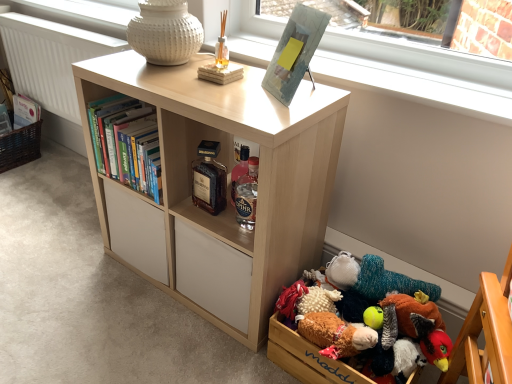
Question: Does fluffy multicolored stuffed toys at lower right, placed as the third toy when sorted from back to front, have a greater height compared to wooden plush toys at lower right?

Choices:
 (A) yes
 (B) no

Answer: (A)

Question: Is fluffy multicolored stuffed toys at lower right, the first toy viewed from the front, turned away from wooden plush toys at lower right?

Choices:
 (A) no
 (B) yes

Answer: (A)

Question: From a real-world perspective, is fluffy multicolored stuffed toys at lower right, placed as the third toy when sorted from back to front, on wooden plush toys at lower right?

Choices:
 (A) no
 (B) yes

Answer: (A)

Question: Does fluffy multicolored stuffed toys at lower right, placed as the third toy when sorted from back to front, have a larger size compared to wooden plush toys at lower right?

Choices:
 (A) yes
 (B) no

Answer: (A)

Question: From a real-world perspective, is fluffy multicolored stuffed toys at lower right, placed as the third toy when sorted from back to front, located beneath wooden plush toys at lower right?

Choices:
 (A) no
 (B) yes

Answer: (B)

Question: Does fluffy multicolored stuffed toys at lower right, the first toy viewed from the front, appear on the right side of wooden plush toys at lower right?

Choices:
 (A) yes
 (B) no

Answer: (A)

Question: From the image's perspective, is white textured radiator at lower left on knitted plush toy at lower right, the 1th toy viewed from the back?

Choices:
 (A) no
 (B) yes

Answer: (B)

Question: Is white textured radiator at lower left next to knitted plush toy at lower right, the 3th toy in the front-to-back sequence, and touching it?

Choices:
 (A) no
 (B) yes

Answer: (A)

Question: Is white textured radiator at lower left further to camera compared to knitted plush toy at lower right, the 3th toy in the front-to-back sequence?

Choices:
 (A) no
 (B) yes

Answer: (B)

Question: Is white textured radiator at lower left outside of knitted plush toy at lower right, the 3th toy in the front-to-back sequence?

Choices:
 (A) no
 (B) yes

Answer: (B)

Question: Is the position of white textured radiator at lower left less distant than that of knitted plush toy at lower right, the 1th toy viewed from the back?

Choices:
 (A) yes
 (B) no

Answer: (B)

Question: From a real-world perspective, is white textured radiator at lower left over knitted plush toy at lower right, the 1th toy viewed from the back?

Choices:
 (A) yes
 (B) no

Answer: (A)

Question: Is wooden plush toys at lower right in front of light wood bookcase at center?

Choices:
 (A) yes
 (B) no

Answer: (B)